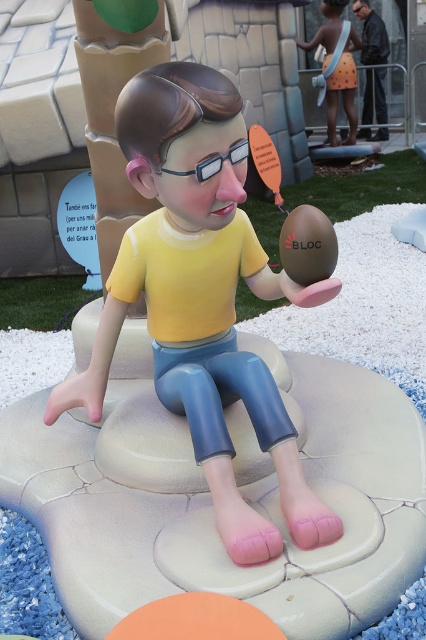
You are a GUI agent. You are given a task and a screenshot of the screen. Output one action in this format:
    pyautogui.click(x=<x>, y=<y>)
    Task: Click on the leather jacket at upper right
    Image resolution: width=426 pixels, height=640 pixels.
    Given the screenshot: What is the action you would take?
    pyautogui.click(x=371, y=33)

Measure the distance from leather jacket at upper right to clear plastic goggles at center.

The distance of leather jacket at upper right from clear plastic goggles at center is 10.02 meters.

Describe the element at coordinates (371, 33) in the screenshot. I see `leather jacket at upper right` at that location.

The width and height of the screenshot is (426, 640). In order to click on leather jacket at upper right in this screenshot , I will do `click(371, 33)`.

You are a GUI agent. You are given a task and a screenshot of the screen. Output one action in this format:
    pyautogui.click(x=<x>, y=<y>)
    Task: Click on the matte yellow shirt at center
    The width and height of the screenshot is (426, 640).
    Given the screenshot: What is the action you would take?
    (201, 298)

Who is more distant from viewer, (189, 77) or (382, 134)?

Positioned behind is point (382, 134).

Measure the distance between matte yellow shirt at center and camera.

A distance of 5.45 feet exists between matte yellow shirt at center and camera.

The height and width of the screenshot is (640, 426). I want to click on matte yellow shirt at center, so click(201, 298).

Consider the image. Who is more forward, [172,250] or [244,156]?

Positioned in front is point [244,156].

From the picture: Is matte yellow shirt at center positioned at the back of clear plastic goggles at center?

No, matte yellow shirt at center is in front of clear plastic goggles at center.

Between point (250, 264) and point (241, 150), which one is positioned in front?

Point (241, 150) is in front.

Find the location of a particular element. matte yellow shirt at center is located at coordinates (201, 298).